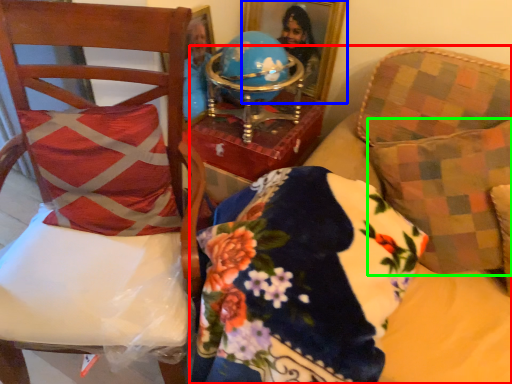
Question: Which is nearer to the furniture (highlighted by a red box)? picture frame (highlighted by a blue box) or throw pillow (highlighted by a green box).

Choices:
 (A) picture frame
 (B) throw pillow

Answer: (B)